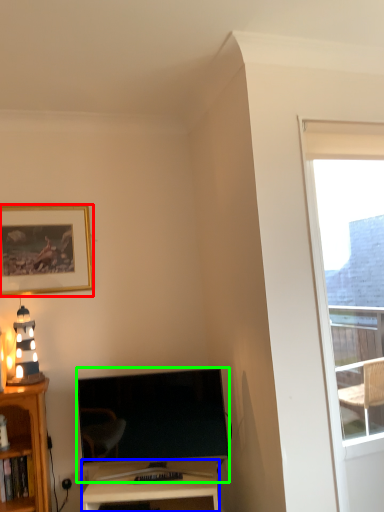
Question: Based on their relative distances, which object is farther from picture frame (highlighted by a red box)? Choose from desk (highlighted by a blue box) and television (highlighted by a green box).

Choices:
 (A) desk
 (B) television

Answer: (A)